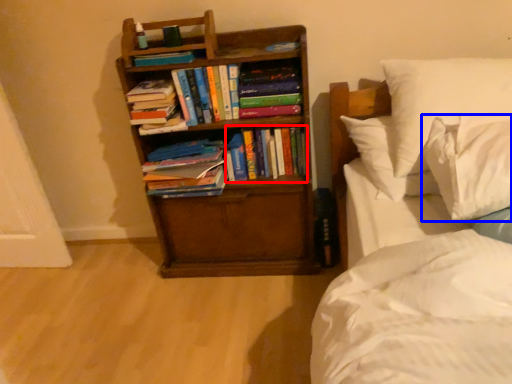
Question: Which object is further to the camera taking this photo, book (highlighted by a red box) or pillow (highlighted by a blue box)?

Choices:
 (A) book
 (B) pillow

Answer: (A)